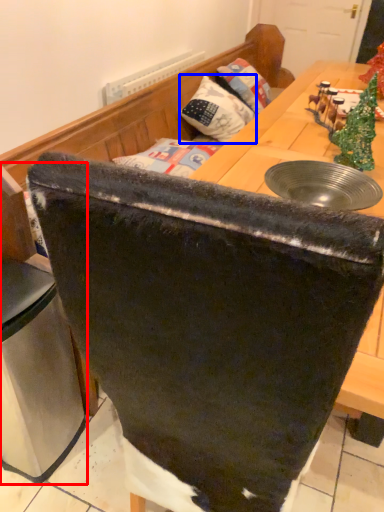
Question: Which object appears closest to the camera in this image, leftover (highlighted by a red box) or pillow (highlighted by a blue box)?

Choices:
 (A) leftover
 (B) pillow

Answer: (A)